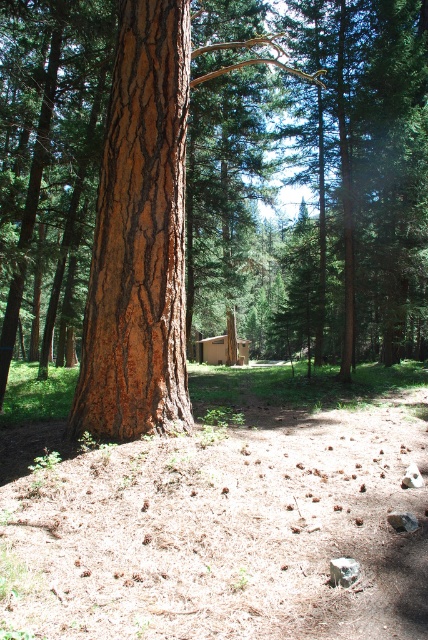
Is brown rough bark tree at center shorter than brown wooden cabin at center?

In fact, brown rough bark tree at center may be taller than brown wooden cabin at center.

Is brown rough bark tree at center bigger than brown wooden cabin at center?

Correct, brown rough bark tree at center is larger in size than brown wooden cabin at center.

What are the coordinates of `brown rough bark tree at center` in the screenshot? It's located at (211, 189).